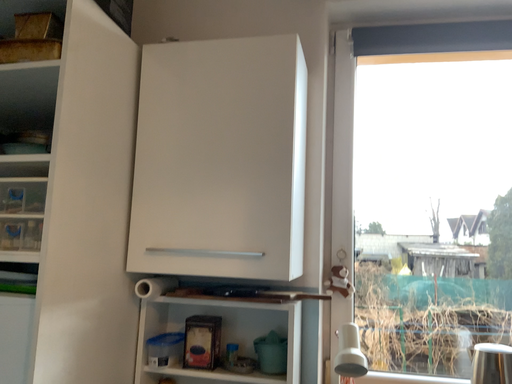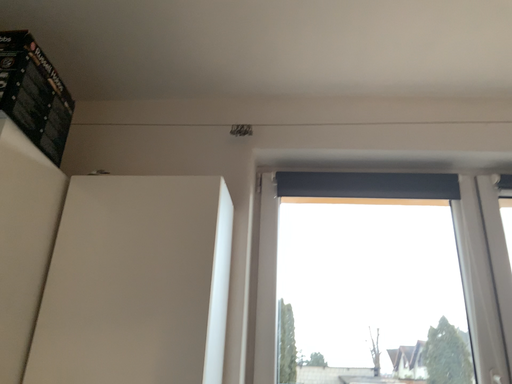
Question: Which way did the camera rotate in the video?

Choices:
 (A) rotated right
 (B) rotated left

Answer: (A)